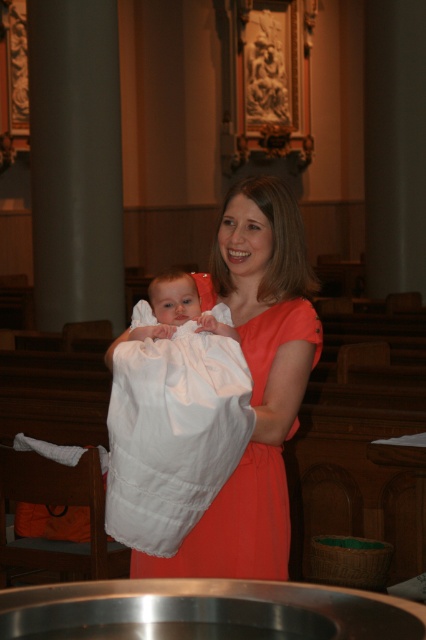
Question: Which point appears closest to the camera in this image?

Choices:
 (A) (189, 541)
 (B) (207, 380)

Answer: (B)

Question: In this image, where is orange satin dress at center located relative to white soft cloth at center?

Choices:
 (A) below
 (B) above

Answer: (B)

Question: Considering the relative positions of orange satin dress at center and white soft cloth at center in the image provided, where is orange satin dress at center located with respect to white soft cloth at center?

Choices:
 (A) right
 (B) left

Answer: (A)

Question: Is orange satin dress at center to the left of white soft cloth at center from the viewer's perspective?

Choices:
 (A) no
 (B) yes

Answer: (A)